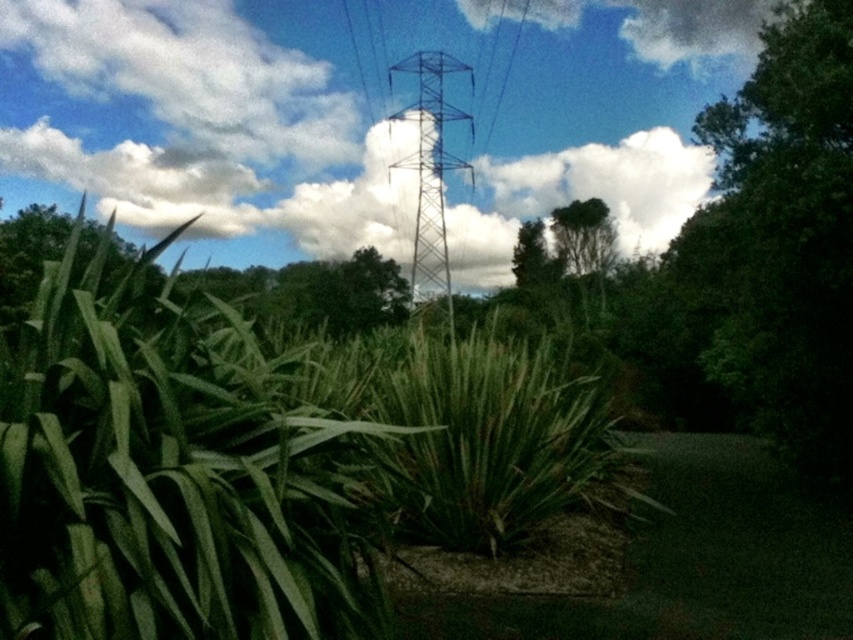
Who is taller, metallic blue tower at center or green leafy tree at upper center?

Standing taller between the two is metallic blue tower at center.

Does metallic blue tower at center appear on the right side of green leafy tree at upper center?

No, metallic blue tower at center is not to the right of green leafy tree at upper center.

Where is `metallic blue tower at center`? The height and width of the screenshot is (640, 853). metallic blue tower at center is located at coordinates (430, 170).